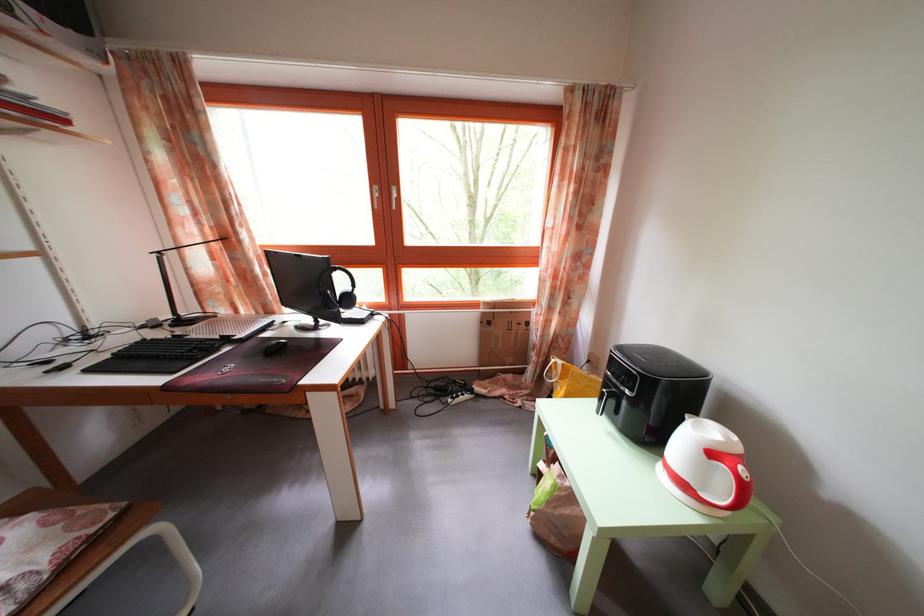
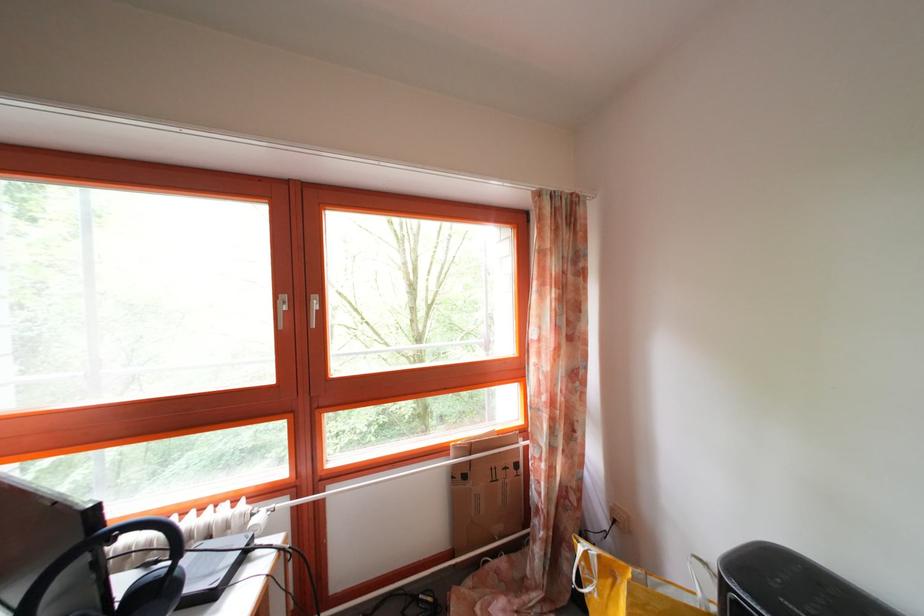
In the second image, find the point that corresponds to the point at 496,330 in the first image.

(472, 484)